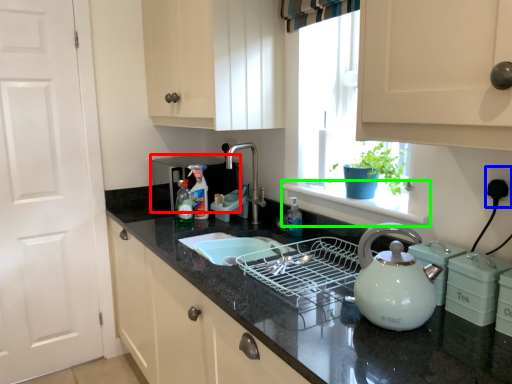
Question: Estimate the real-world distances between objects in this image. Which object is closer to appliance (highlighted by a red box), electric outlet (highlighted by a blue box) or window sill (highlighted by a green box)?

Choices:
 (A) electric outlet
 (B) window sill

Answer: (B)